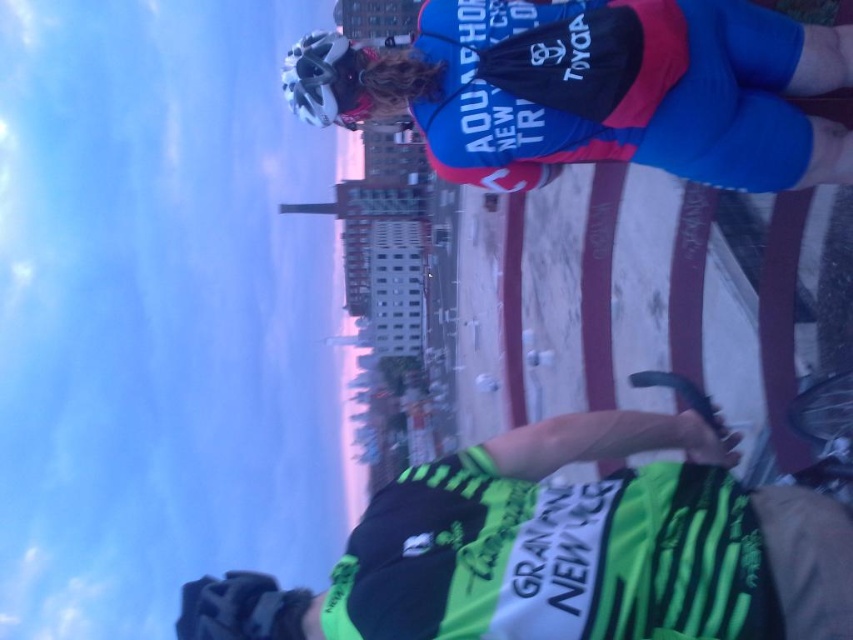
Is green striped jersey at lower right positioned in front of white matte bicycle helmet at upper center?

Yes, green striped jersey at lower right is in front of white matte bicycle helmet at upper center.

Measure the distance between point [799,524] and camera.

A distance of 36.84 meters exists between point [799,524] and camera.

Describe the element at coordinates (561, 548) in the screenshot. I see `green striped jersey at lower right` at that location.

This screenshot has height=640, width=853. In order to click on green striped jersey at lower right in this screenshot , I will do `click(561, 548)`.

Can you confirm if matte blue helmet at upper center is positioned to the left of white matte bicycle helmet at upper center?

No, matte blue helmet at upper center is not to the left of white matte bicycle helmet at upper center.

Find the location of `matte blue helmet at upper center`. matte blue helmet at upper center is located at coordinates (595, 90).

Can you confirm if green striped jersey at lower right is smaller than matte blue helmet at upper center?

Incorrect, green striped jersey at lower right is not smaller in size than matte blue helmet at upper center.

This screenshot has width=853, height=640. I want to click on green striped jersey at lower right, so click(561, 548).

This screenshot has width=853, height=640. In order to click on green striped jersey at lower right in this screenshot , I will do `click(561, 548)`.